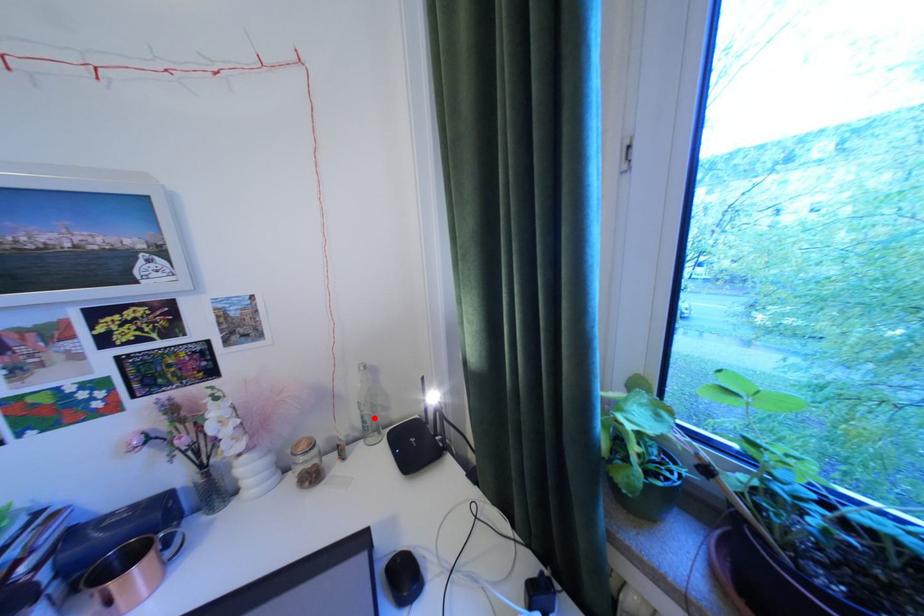
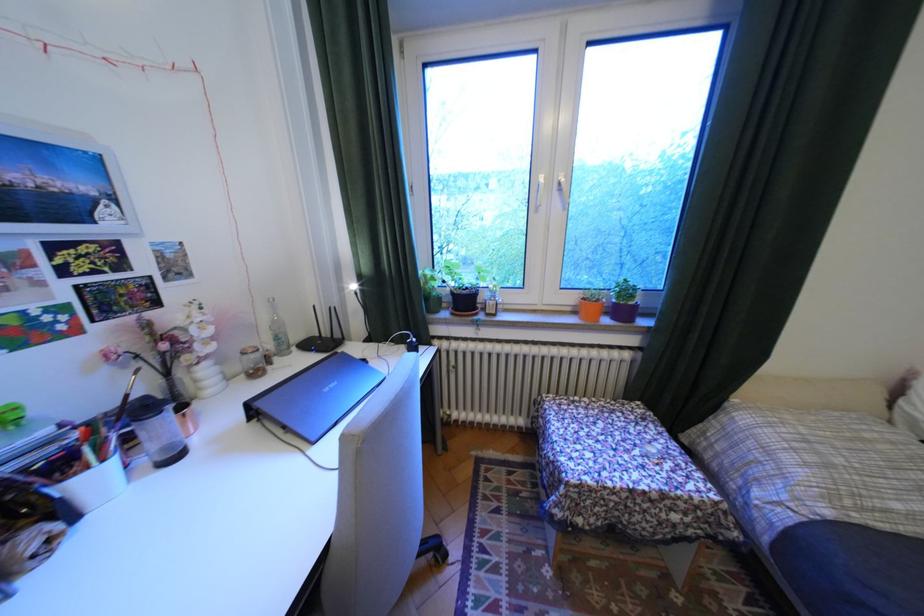
Find the pixel in the second image that matches the highlighted location in the first image.

(287, 338)